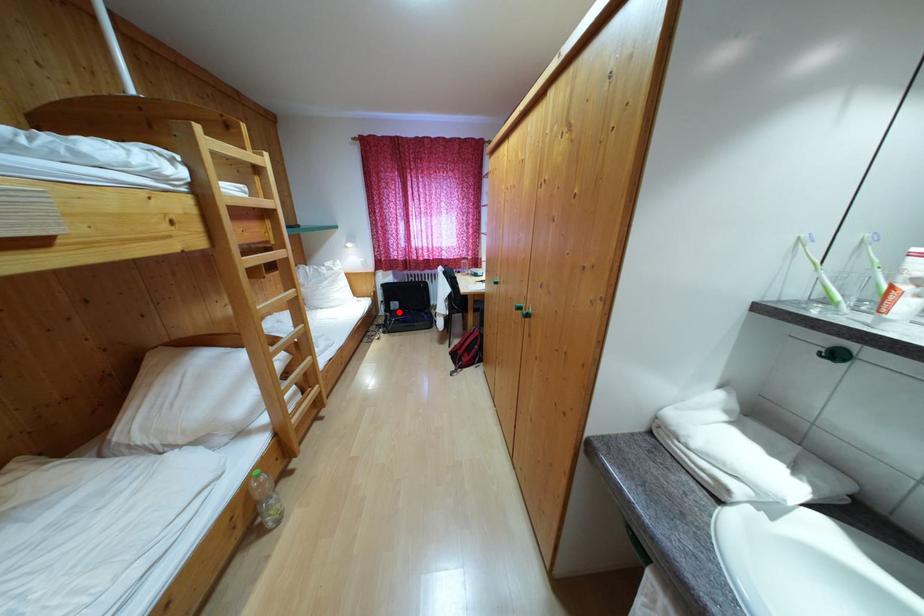
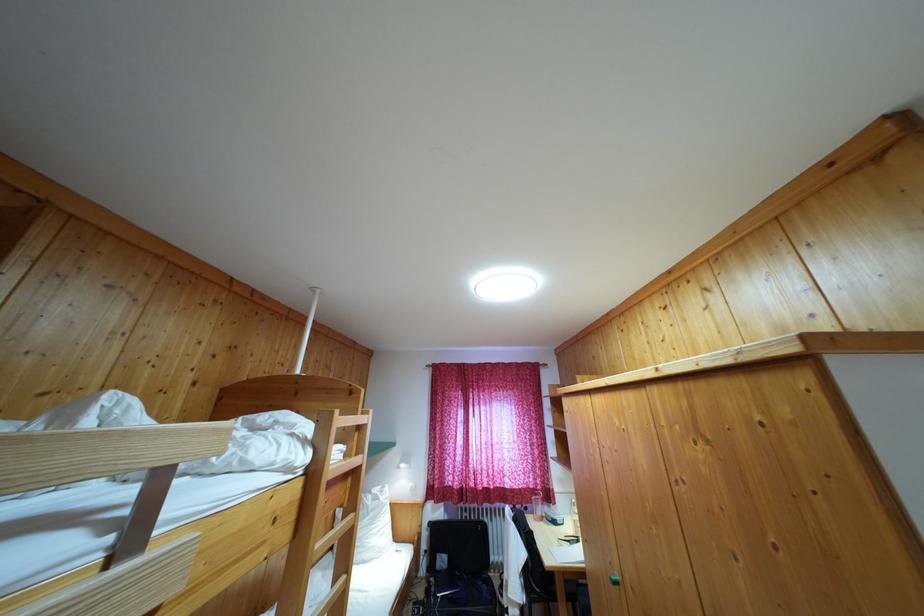
Question: I am providing you with two images of the same scene from different viewpoints. A red point is shown in image1. For the corresponding object point in image2, is it positioned nearer or farther from the camera?

Choices:
 (A) Nearer
 (B) Farther

Answer: (A)